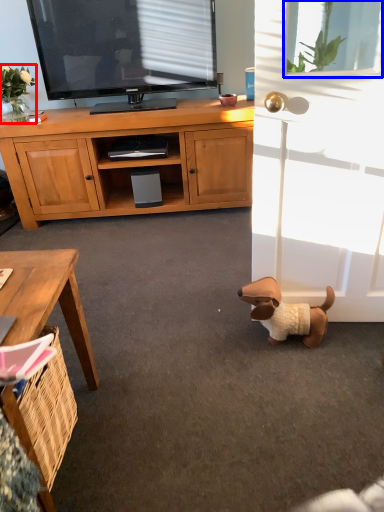
Question: Which object is further to the camera taking this photo, flower (highlighted by a red box) or window screen (highlighted by a blue box)?

Choices:
 (A) flower
 (B) window screen

Answer: (A)